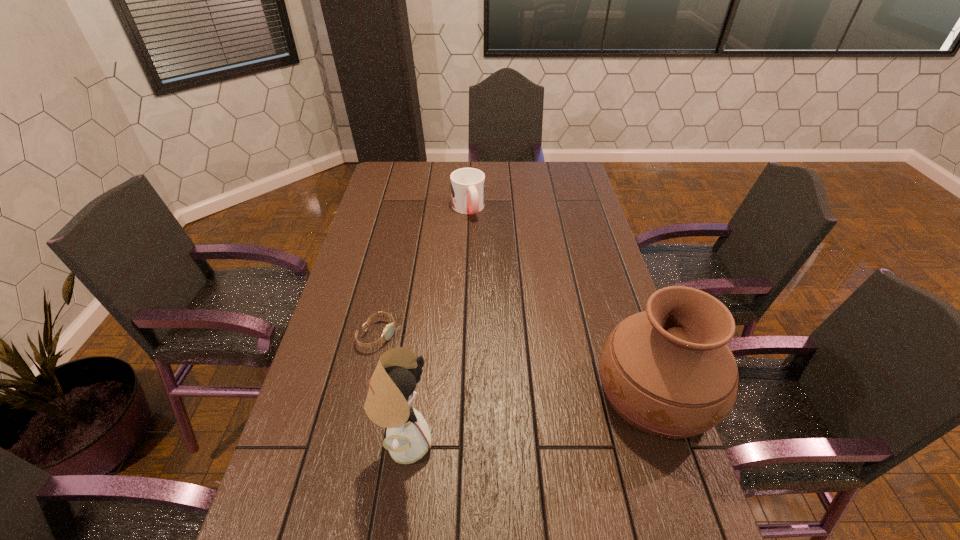
Image resolution: width=960 pixels, height=540 pixels. Find the location of `free space between the rightmost object and the shortest object`. free space between the rightmost object and the shortest object is located at coordinates (516, 363).

This screenshot has height=540, width=960. In order to click on empty space that is in between the watch and the urn in this screenshot , I will do `click(516, 363)`.

Image resolution: width=960 pixels, height=540 pixels. Find the location of `unoccupied area between the urn and the doll`. unoccupied area between the urn and the doll is located at coordinates (530, 417).

Locate an element on the screen. Image resolution: width=960 pixels, height=540 pixels. free point between the rightmost object and the farthest object is located at coordinates (562, 300).

Locate an element on the screen. free space between the watch and the farthest object is located at coordinates (422, 272).

I want to click on free spot between the rightmost object and the third tallest object, so click(x=562, y=300).

The height and width of the screenshot is (540, 960). What are the coordinates of `free space that is in between the second shortest object and the doll` in the screenshot? It's located at (436, 326).

Choose which object is the second nearest neighbor to the rightmost object. Please provide its 2D coordinates. Your answer should be formatted as a tuple, i.e. [(x, y)], where the tuple contains the x and y coordinates of a point satisfying the conditions above.

[(388, 331)]

Locate an element on the screen. Image resolution: width=960 pixels, height=540 pixels. object that can be found as the second closest to the doll is located at coordinates (668, 371).

In order to click on vacant area that satisfies the following two spatial constraints: 1. on the front side of the shortest object; 2. at the front face of the doll in this screenshot , I will do `click(353, 442)`.